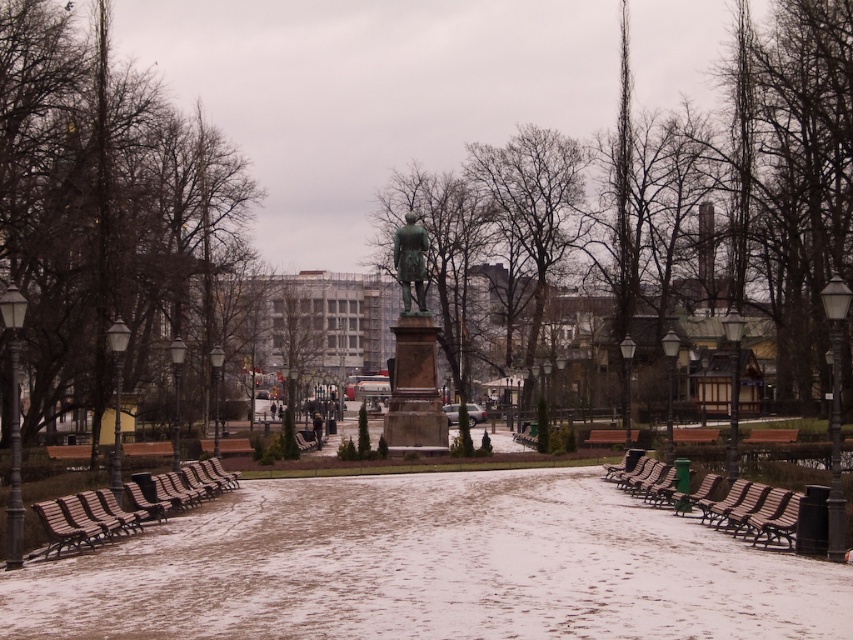
You are standing at the entrance of the park and see the green leafless tree at center. If you walk straight ahead, will you reach the tree before the statue?

The green leafless tree at center is positioned at point (741, 188). Since the statue is in the middle of the pathway, the tree is further away from the entrance than the statue. Therefore, you will reach the statue first before the tree.

You are a bird looking for a place to perch. You see the bare branches at center and the wooden park bench at lower left. Which one would be a better option for a higher perch?

The bare branches at center are much taller than the wooden park bench at lower left, so the bare branches at center would provide a higher perch for the bird.